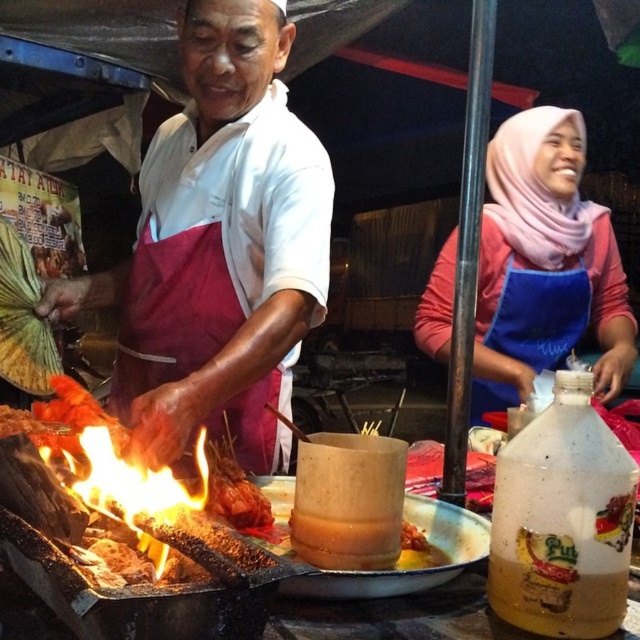
What object is located at the coordinates point (218,248) in the image?

The point (218,248) indicates the white matte apron at center.